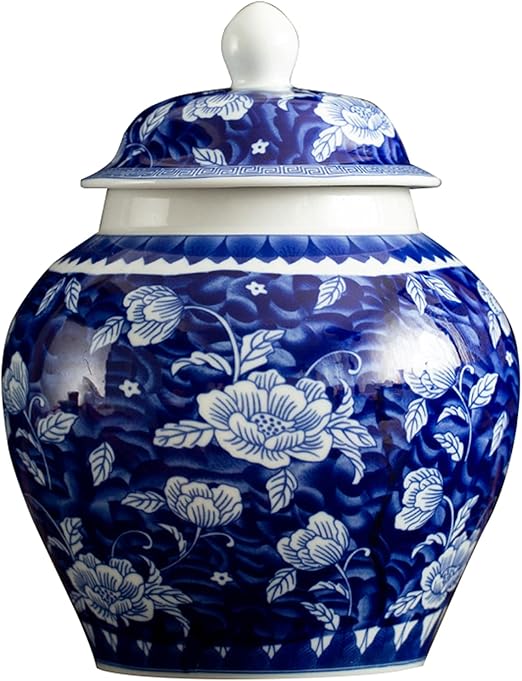
Image resolution: width=522 pixels, height=681 pixels. In order to click on urn in this screenshot , I will do `click(327, 380)`.